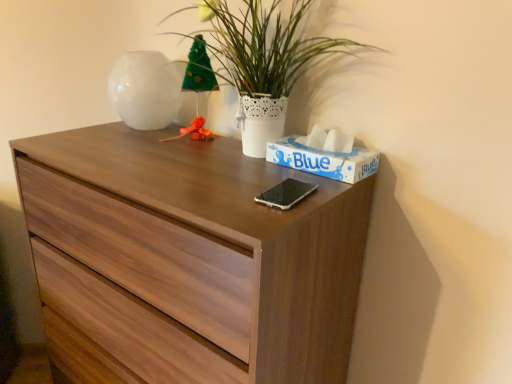
You are a GUI agent. You are given a task and a screenshot of the screen. Output one action in this format:
    pyautogui.click(x=<x>, y=<y>)
    Task: Click on the blank space to the left of blue cardboard tissue box at upper right
    Image resolution: width=512 pixels, height=384 pixels.
    Given the screenshot: What is the action you would take?
    pyautogui.click(x=240, y=166)